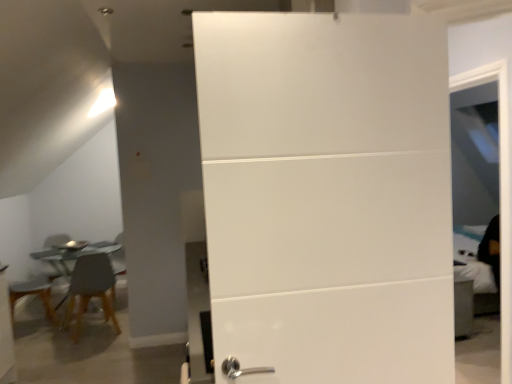
Question: Is matte brown wooden chair at left at the left side of metallic glass table at left?

Choices:
 (A) yes
 (B) no

Answer: (B)

Question: Is matte brown wooden chair at left behind metallic glass table at left?

Choices:
 (A) no
 (B) yes

Answer: (A)

Question: Considering the relative sizes of matte brown wooden chair at left and metallic glass table at left in the image provided, is matte brown wooden chair at left thinner than metallic glass table at left?

Choices:
 (A) yes
 (B) no

Answer: (A)

Question: Is matte brown wooden chair at left positioned far away from metallic glass table at left?

Choices:
 (A) yes
 (B) no

Answer: (B)

Question: Does matte brown wooden chair at left have a greater height compared to metallic glass table at left?

Choices:
 (A) yes
 (B) no

Answer: (A)

Question: Is matte brown wooden chair at left located outside metallic glass table at left?

Choices:
 (A) no
 (B) yes

Answer: (A)

Question: From the image's perspective, is metallic glass table at left over matte brown wooden chair at left?

Choices:
 (A) yes
 (B) no

Answer: (B)

Question: Does metallic glass table at left have a greater width compared to matte brown wooden chair at left?

Choices:
 (A) no
 (B) yes

Answer: (B)

Question: Is the position of metallic glass table at left more distant than that of matte brown wooden chair at left?

Choices:
 (A) no
 (B) yes

Answer: (B)

Question: Considering the relative sizes of metallic glass table at left and matte brown wooden chair at left in the image provided, is metallic glass table at left thinner than matte brown wooden chair at left?

Choices:
 (A) no
 (B) yes

Answer: (A)

Question: From a real-world perspective, is metallic glass table at left below matte brown wooden chair at left?

Choices:
 (A) yes
 (B) no

Answer: (A)

Question: Considering the relative sizes of metallic glass table at left and matte brown wooden chair at left in the image provided, is metallic glass table at left taller than matte brown wooden chair at left?

Choices:
 (A) yes
 (B) no

Answer: (B)

Question: Is matte brown wooden chair at left oriented towards white glossy door at center?

Choices:
 (A) yes
 (B) no

Answer: (B)